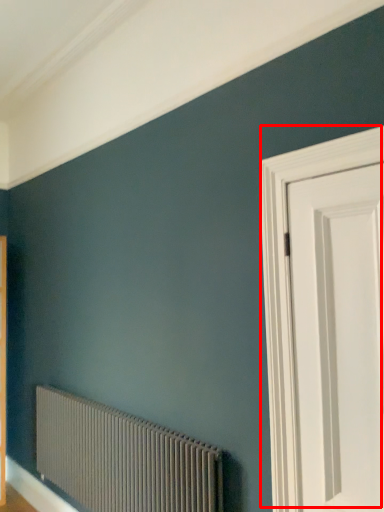
Question: From the image's perspective, where is door (annotated by the red box) located in relation to radiator in the image?

Choices:
 (A) below
 (B) above

Answer: (B)